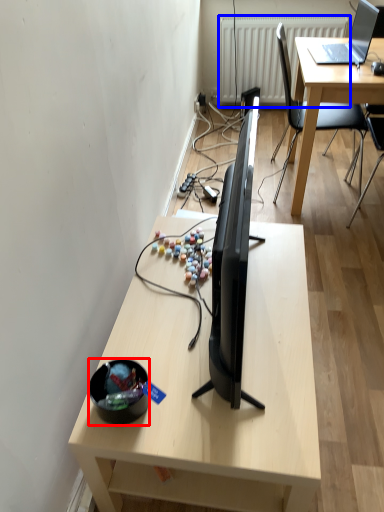
Question: Which object is closer to the camera taking this photo, bowl (highlighted by a red box) or radiator (highlighted by a blue box)?

Choices:
 (A) bowl
 (B) radiator

Answer: (A)